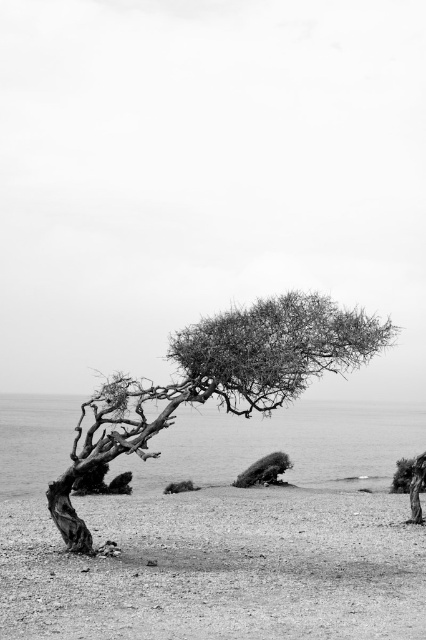
You are a GUI agent. You are given a task and a screenshot of the screen. Output one action in this format:
    pyautogui.click(x=<x>, y=<y>)
    Task: Click on the smooth sand at lower left
    
    Given the screenshot: What is the action you would take?
    pyautogui.click(x=218, y=568)

Can you confirm if smooth sand at lower left is positioned below fuzzy fur animal at center?

No, smooth sand at lower left is not below fuzzy fur animal at center.

Who is more forward, (x=385, y=529) or (x=180, y=481)?

Point (x=385, y=529) is more forward.

Locate an element on the screen. This screenshot has height=640, width=426. smooth sand at lower left is located at coordinates (218, 568).

Between point (256, 497) and point (290, 323), which one is positioned in front?

Point (290, 323) is more forward.

What are the coordinates of `smooth sand at lower left` in the screenshot? It's located at (218, 568).

Does thorny bark tree at center lie in front of fuzzy fur animal at center?

Yes, thorny bark tree at center is closer to the viewer.

Which is more to the left, thorny bark tree at center or fuzzy fur animal at center?

Positioned to the left is fuzzy fur animal at center.

Find the location of `thorny bark tree at center`. thorny bark tree at center is located at coordinates (221, 380).